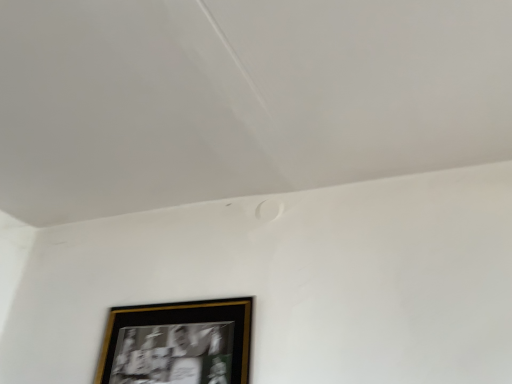
At what (x,y) coordinates should I click in order to perform the action: click on black/golden frame at lower center. Please return your answer as a coordinate pair (x, y). The width and height of the screenshot is (512, 384). Looking at the image, I should click on (178, 343).

What do you see at coordinates (178, 343) in the screenshot? This screenshot has width=512, height=384. I see `black/golden frame at lower center` at bounding box center [178, 343].

Image resolution: width=512 pixels, height=384 pixels. Identify the location of black/golden frame at lower center. (178, 343).